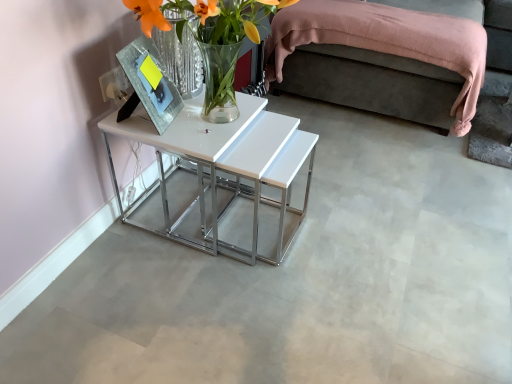
Question: Is there a large distance between white glossy table at center and pink fabric bed at upper right?

Choices:
 (A) yes
 (B) no

Answer: (B)

Question: Is white glossy table at center positioned beyond the bounds of pink fabric bed at upper right?

Choices:
 (A) no
 (B) yes

Answer: (B)

Question: Is white glossy table at center next to pink fabric bed at upper right?

Choices:
 (A) no
 (B) yes

Answer: (A)

Question: From a real-world perspective, is white glossy table at center physically below pink fabric bed at upper right?

Choices:
 (A) yes
 (B) no

Answer: (A)

Question: Is white glossy table at center oriented towards pink fabric bed at upper right?

Choices:
 (A) yes
 (B) no

Answer: (B)

Question: From the image's perspective, is white glossy table at center located above or below translucent glass vase at center?

Choices:
 (A) below
 (B) above

Answer: (A)

Question: Is white glossy table at center taller or shorter than translucent glass vase at center?

Choices:
 (A) tall
 (B) short

Answer: (A)

Question: Is point (175, 145) closer or farther from the camera than point (176, 29)?

Choices:
 (A) farther
 (B) closer

Answer: (A)

Question: In the image, is white glossy table at center on the left side or the right side of translucent glass vase at center?

Choices:
 (A) right
 (B) left

Answer: (B)

Question: In the image, is white glossy table at center positioned in front of or behind pink fabric bed at upper right?

Choices:
 (A) behind
 (B) front

Answer: (B)

Question: In terms of width, does white glossy table at center look wider or thinner when compared to pink fabric bed at upper right?

Choices:
 (A) wide
 (B) thin

Answer: (A)

Question: From a real-world perspective, is white glossy table at center above or below pink fabric bed at upper right?

Choices:
 (A) below
 (B) above

Answer: (A)

Question: From the image's perspective, relative to pink fabric bed at upper right, is white glossy table at center above or below?

Choices:
 (A) below
 (B) above

Answer: (A)

Question: Is point (308, 82) positioned closer to the camera than point (205, 231)?

Choices:
 (A) closer
 (B) farther

Answer: (B)

Question: From a real-world perspective, is pink fabric bed at upper right physically located above or below white glossy table at center?

Choices:
 (A) below
 (B) above

Answer: (B)